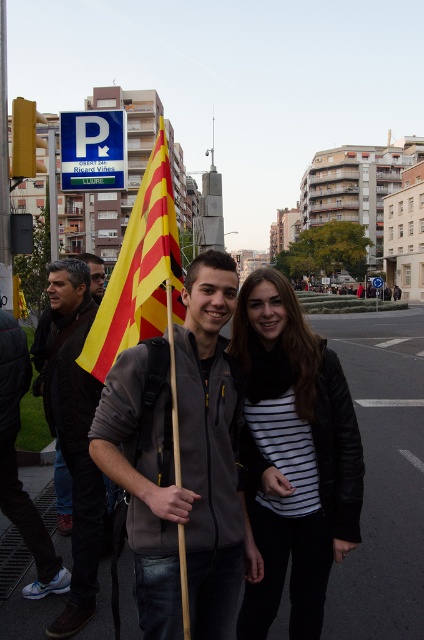
You are a photographer positioned at the center of the image. You want to capture a photo that includes both the matte gray hoodie at center and the person on the left with the Catalan flag. Which direction should you move to ensure both subjects are in frame?

The matte gray hoodie at center is located at point (183, 467), so you should move to the left to include both the matte gray hoodie at center and the person on the left with the Catalan flag in the frame.

You are a photographer standing at the center of the street scene. You want to take a photo that includes both the person holding the Catalan flag and the other person. However, you notice two specific points in the image marked as point A at coordinates point A is at point (256, 554) and point B at point B is at point (131, 321). Which point should you focus on to ensure both subjects are in frame without needing to adjust your position?

You should focus on point B at point (131, 321) because point A at point (256, 554) is behind it. By focusing on the closer point B, both subjects will be within the frame without needing to move.

You are a photographer trying to capture both the striped fabric shirt at center and the yellowstriped fabricflag at left in a single frame. Given their sizes, which object should you focus on to ensure both fit in the frame without cropping?

Since the striped fabric shirt at center occupies less space than the yellowstriped fabricflag at left, you should focus on the yellowstriped fabricflag at left as it is larger and will require more attention to fit properly in the frame.